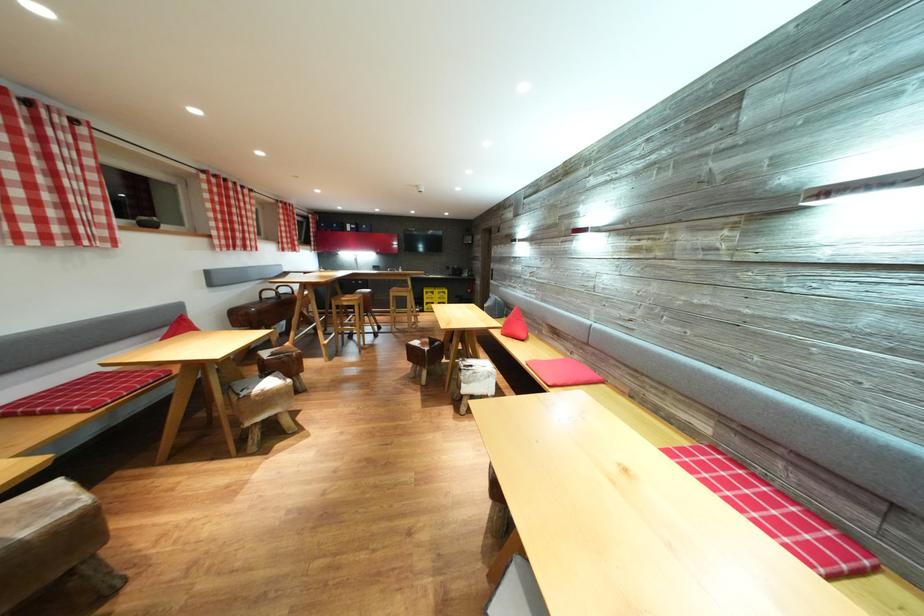
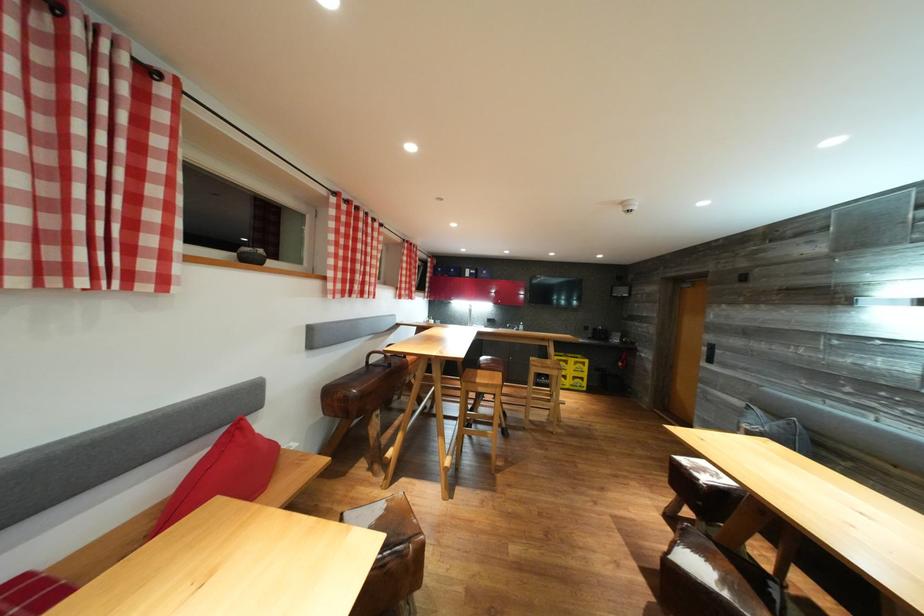
Find the pixel in the second image that matches [444,297] in the first image.

(578, 366)